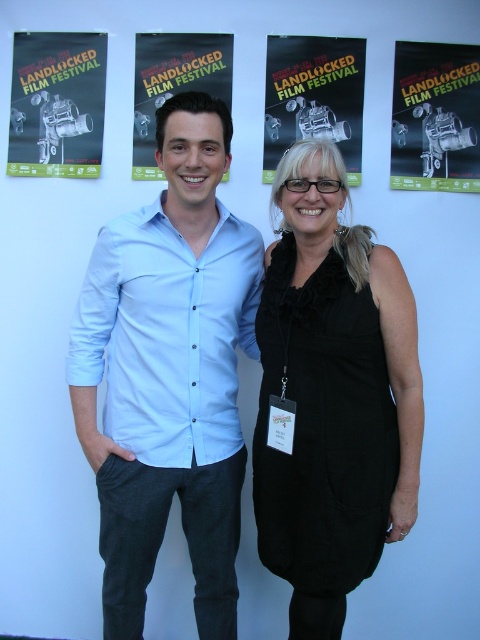
You are an event photographer at a film festival. You need to position your matte black film camera at upper right so that it points towards the matte black film festival poster at center. Is the camera already positioned to the correct side of the poster?

The matte black film camera at upper right is to the right of the matte black film festival poster at center, so the camera is positioned to the correct side of the poster.

In the scene shown: You are an assistant at a fashion show. You need to place a new accessory that is 10 cm tall on the display table. The table can only accommodate items that are shorter than the black velvet dress at center. Can the matte black film camera at upper right be placed on the table along with the accessory?

The black velvet dress at center has a greater height compared to matte black film camera at upper right. Since the accessory is 10 cm tall and the table requires items shorter than the dress, the matte black film camera at upper right can be placed on the table as long as its height is less than the dress. However, without knowing the exact height of the dress, we cannot definitively confirm. Wait, but according to the Objects Description, the dress is taller than the camera. So if the camera is shorter, 1